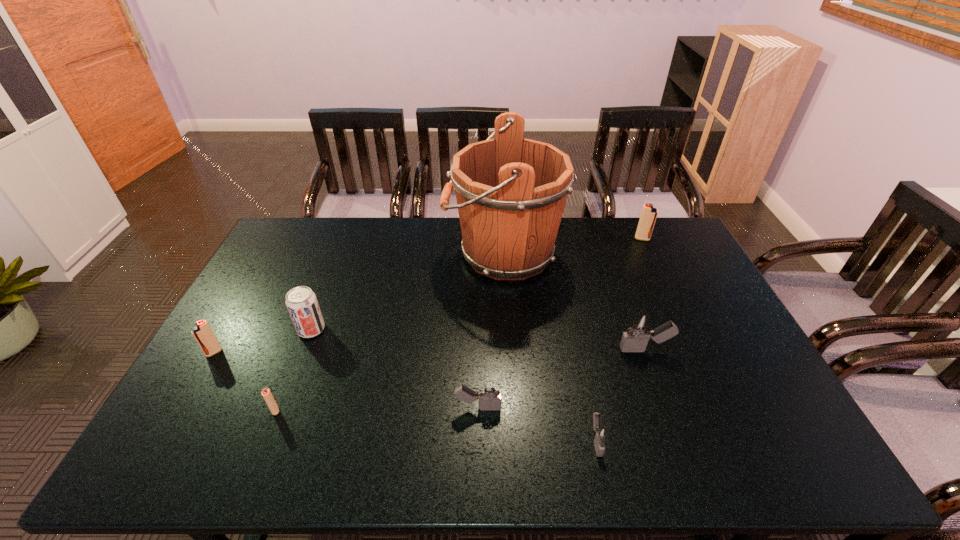
Find the location of a particular element. The height and width of the screenshot is (540, 960). bucket is located at coordinates (511, 191).

You are a GUI agent. You are given a task and a screenshot of the screen. Output one action in this format:
    pyautogui.click(x=<x>, y=<y>)
    Task: Click on the biggest red igniter
    The image size is (960, 540).
    Given the screenshot: What is the action you would take?
    coord(649,214)

This screenshot has width=960, height=540. I want to click on the farthest igniter, so click(649, 214).

The height and width of the screenshot is (540, 960). I want to click on the fifth igniter from left to right, so click(x=638, y=331).

This screenshot has width=960, height=540. I want to click on the rightmost gray igniter, so click(638, 331).

This screenshot has width=960, height=540. I want to click on soda can, so click(301, 302).

The image size is (960, 540). What are the coordinates of `the second biggest gray igniter` in the screenshot? It's located at click(489, 393).

At what (x,y) coordinates should I click in order to perform the action: click on the third igniter from left to right. Please return your answer as a coordinate pair (x, y). This screenshot has height=540, width=960. Looking at the image, I should click on (489, 393).

At what (x,y) coordinates should I click in order to perform the action: click on the leftmost red igniter. Please return your answer as a coordinate pair (x, y). Looking at the image, I should click on (203, 334).

What are the coordinates of `the leftmost object` in the screenshot? It's located at (203, 334).